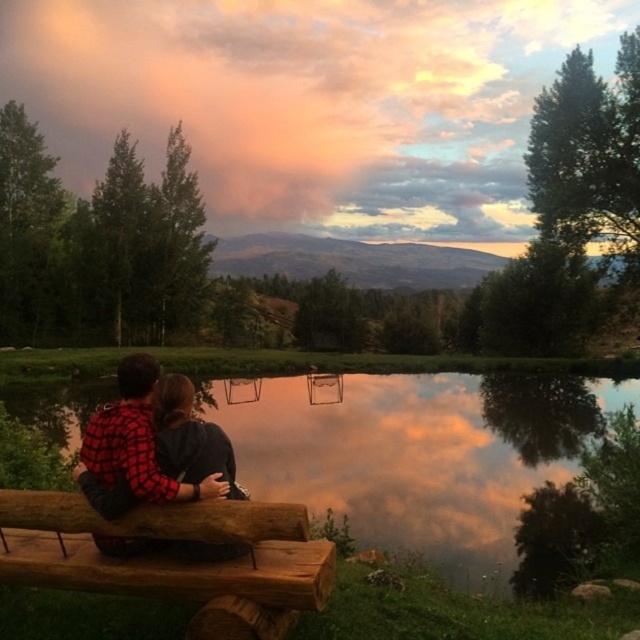
You are standing at the edge of the water and want to take a photo of the smooth reflective water at center and the red plaid shirt at lower left. Which object will appear taller in the photo?

The smooth reflective water at center will appear taller in the photo because it has a greater height compared to the red plaid shirt at lower left.

You are standing at the camera position observing the scene. Where is the smooth reflective water at center located in terms of coordinates?

The smooth reflective water at center is located at coordinates point (419,456).